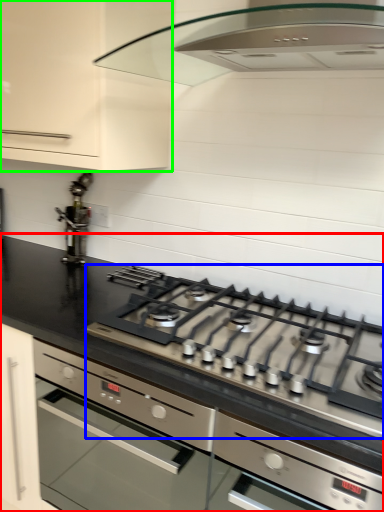
Question: Which is farther away from countertop (highlighted by a red box)? gas stove (highlighted by a blue box) or cabinetry (highlighted by a green box)?

Choices:
 (A) gas stove
 (B) cabinetry

Answer: (B)